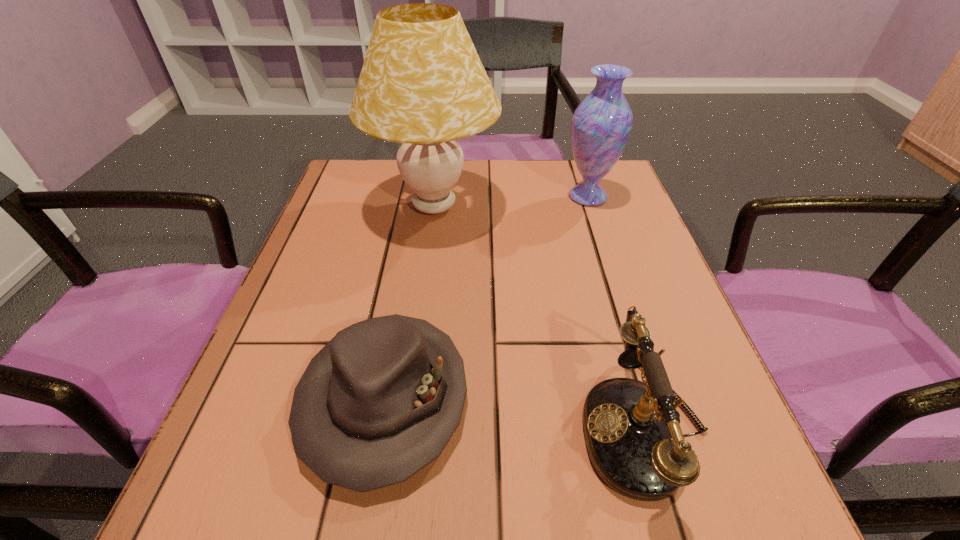
Find the location of a particular element. This screenshot has height=540, width=960. free spot between the tallest object and the vase is located at coordinates (511, 201).

Identify the location of vacant area between the shortest object and the third tallest object. (514, 413).

Identify the location of vacant area between the third tallest object and the shortest object. Image resolution: width=960 pixels, height=540 pixels. (514, 413).

This screenshot has height=540, width=960. Identify the location of vacant area that lies between the third tallest object and the shortest object. (514, 413).

Locate an element on the screen. vacant space that is in between the third tallest object and the vase is located at coordinates (615, 312).

The image size is (960, 540). In order to click on unoccupied area between the telephone and the vase in this screenshot , I will do `click(615, 312)`.

You are a GUI agent. You are given a task and a screenshot of the screen. Output one action in this format:
    pyautogui.click(x=<x>, y=<y>)
    Task: Click on the free space between the tallest object and the shortest object
    The height and width of the screenshot is (540, 960).
    Given the screenshot: What is the action you would take?
    pyautogui.click(x=409, y=302)

The image size is (960, 540). What are the coordinates of `object identified as the closest to the second tallest object` in the screenshot? It's located at (422, 84).

Point out which object is positioned as the third nearest to the hat. Please provide its 2D coordinates. Your answer should be formatted as a tuple, i.e. [(x, y)], where the tuple contains the x and y coordinates of a point satisfying the conditions above.

[(601, 124)]